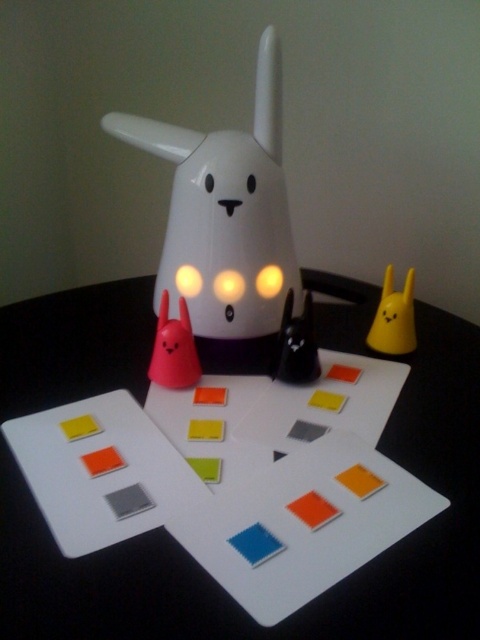
Which is more to the right, white plastic table at center or yellow matte rabbit at upper right?

yellow matte rabbit at upper right is more to the right.

Between white plastic table at center and yellow matte rabbit at upper right, which one has more height?

With more height is white plastic table at center.

Is point (432, 403) farther from viewer compared to point (377, 314)?

No.

This screenshot has width=480, height=640. In order to click on white plastic table at center in this screenshot , I will do `click(320, 596)`.

Is point (239, 198) positioned before point (411, 296)?

Yes.

Can you confirm if white glossy rabbit at center is positioned below yellow matte rabbit at upper right?

Actually, white glossy rabbit at center is above yellow matte rabbit at upper right.

This screenshot has width=480, height=640. What do you see at coordinates (226, 212) in the screenshot?
I see `white glossy rabbit at center` at bounding box center [226, 212].

You are a GUI agent. You are given a task and a screenshot of the screen. Output one action in this format:
    pyautogui.click(x=<x>, y=<y>)
    Task: Click on the white glossy rabbit at center
    
    Given the screenshot: What is the action you would take?
    226,212

Which is more to the right, white plastic table at center or white glossy rabbit at center?

From the viewer's perspective, white plastic table at center appears more on the right side.

Identify the location of white plastic table at center. The image size is (480, 640). (320, 596).

The width and height of the screenshot is (480, 640). I want to click on white plastic table at center, so click(320, 596).